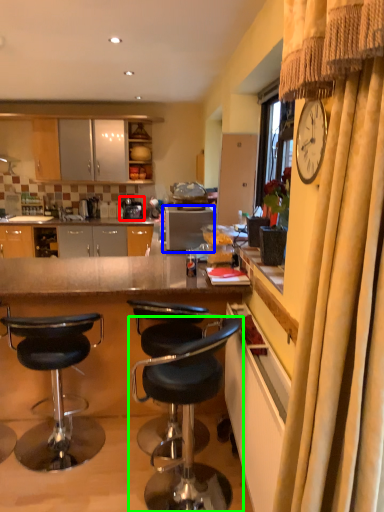
Question: Estimate the real-world distances between objects in this image. Which object is closer to coffee machine (highlighted by a red box), appliance (highlighted by a blue box) or chair (highlighted by a green box)?

Choices:
 (A) appliance
 (B) chair

Answer: (A)